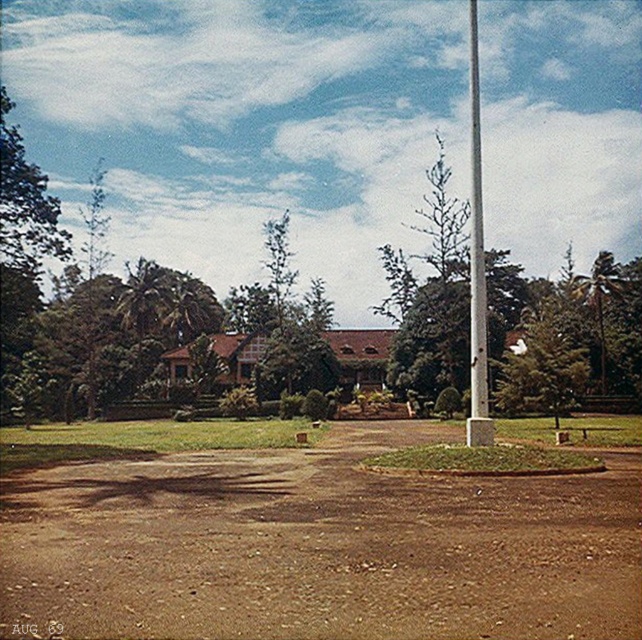
You are a gardener planning to plant a new tree in the center of the lawn. The existing green leafy tree at center and white glossy pole at center are already there. Which object is smaller and should be considered for spacing?

The green leafy tree at center is smaller than the white glossy pole at center, so it should be considered for spacing when planting the new tree.

You are standing at the point labeled point (573, 604) and want to walk towards the point labeled point (553, 323). Which direction should you face to move directly towards your destination?

You should face towards the point (553, 323) because it is further away from the camera compared to your current position at point (573, 604).

You are a gardener planning to plant a new tree in the lawn. You notice the green leafy tree at center and the white glossy pole at center. Which object is narrower, and therefore might allow more space for the new tree?

The green leafy tree at center is narrower than the white glossy pole at center, so planting the new tree near it might provide more space.